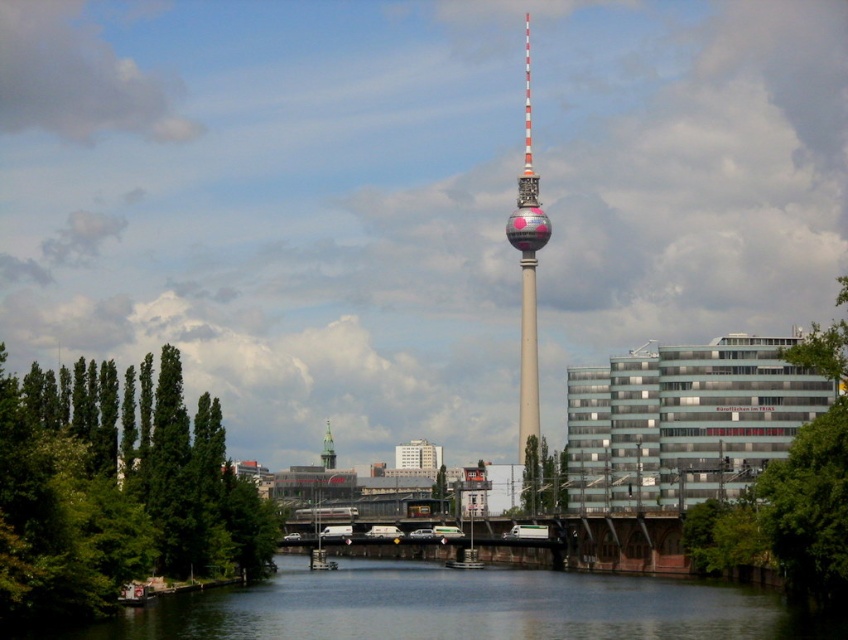
Identify the location of polished steel tower at center. This screenshot has height=640, width=848. (527, 268).

Who is higher up, polished steel tower at center or silver metallic clock tower at center?

Positioned higher is polished steel tower at center.

The height and width of the screenshot is (640, 848). What do you see at coordinates (527, 268) in the screenshot?
I see `polished steel tower at center` at bounding box center [527, 268].

This screenshot has height=640, width=848. I want to click on polished steel tower at center, so click(527, 268).

Is smooth dark water at center smaller than polished steel tower at center?

No.

Is point (752, 624) positioned after point (522, 320)?

No, (752, 624) is in front of (522, 320).

Is point (467, 579) closer to camera compared to point (528, 349)?

That is True.

This screenshot has height=640, width=848. Identify the location of smooth dark water at center. (461, 608).

Which is behind, point (289, 632) or point (332, 460)?

Point (332, 460)

Who is lower down, smooth dark water at center or silver metallic clock tower at center?

smooth dark water at center is below.

Does point (276, 616) come in front of point (333, 461)?

Yes, point (276, 616) is closer to viewer.

Image resolution: width=848 pixels, height=640 pixels. I want to click on smooth dark water at center, so click(461, 608).